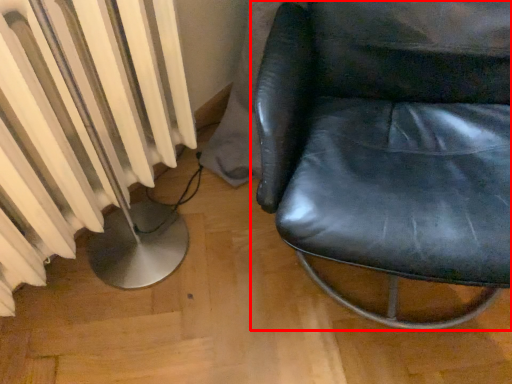
Question: Considering the relative positions of chair (annotated by the red box) and radiator in the image provided, where is chair (annotated by the red box) located with respect to the staircase?

Choices:
 (A) right
 (B) left

Answer: (A)